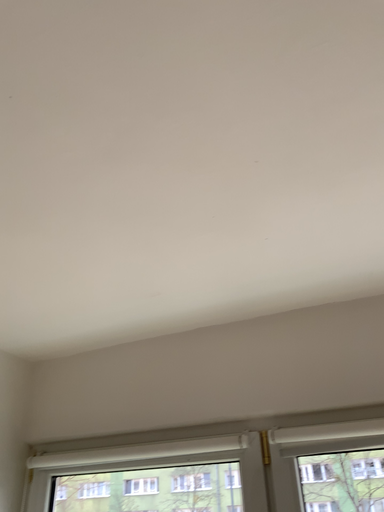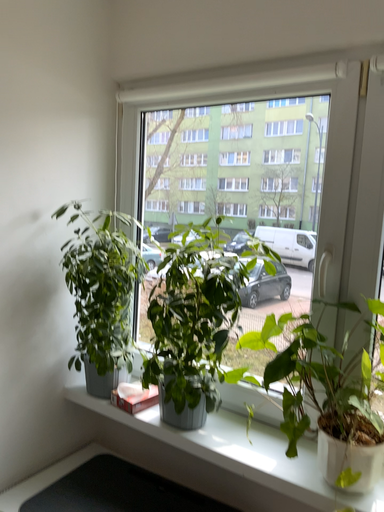
Question: Which way did the camera rotate in the video?

Choices:
 (A) rotated downward
 (B) rotated upward

Answer: (A)